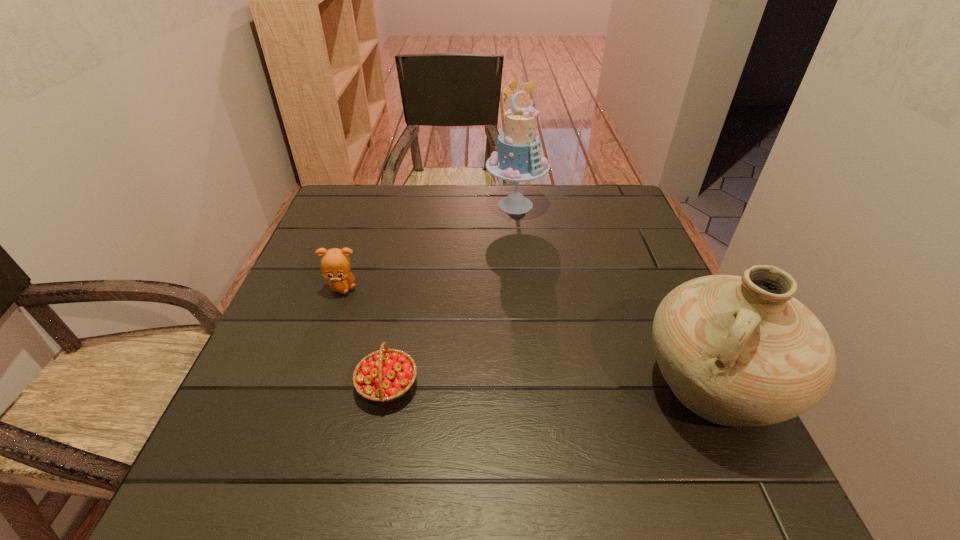
Find the location of a particular element. blank region between the farthest object and the rightmost object is located at coordinates (614, 295).

This screenshot has height=540, width=960. Identify the location of free space between the shortest object and the teddy bear. (366, 336).

Locate an element on the screen. empty space between the second object from left to right and the leftmost object is located at coordinates (x=366, y=336).

Identify the location of unoccupied position between the second tallest object and the cake. The width and height of the screenshot is (960, 540). (614, 295).

Where is `free spot between the teddy bear and the third shortest object`? The width and height of the screenshot is (960, 540). free spot between the teddy bear and the third shortest object is located at coordinates (528, 337).

This screenshot has height=540, width=960. I want to click on free space between the leftmost object and the rightmost object, so click(528, 337).

You are a GUI agent. You are given a task and a screenshot of the screen. Output one action in this format:
    pyautogui.click(x=<x>, y=<y>)
    Task: Click on the free space between the second object from left to right and the tallest object
    The height and width of the screenshot is (540, 960).
    Given the screenshot: What is the action you would take?
    pyautogui.click(x=451, y=295)

You are a GUI agent. You are given a task and a screenshot of the screen. Output one action in this format:
    pyautogui.click(x=<x>, y=<y>)
    Task: Click on the free space between the shortest object and the farthest object
    Image resolution: width=960 pixels, height=540 pixels.
    Given the screenshot: What is the action you would take?
    pyautogui.click(x=451, y=295)

Where is `object that is the third closest to the third tallest object`? The width and height of the screenshot is (960, 540). object that is the third closest to the third tallest object is located at coordinates (736, 350).

Where is `object that stands as the closest to the strawberry`? The height and width of the screenshot is (540, 960). object that stands as the closest to the strawberry is located at coordinates (335, 264).